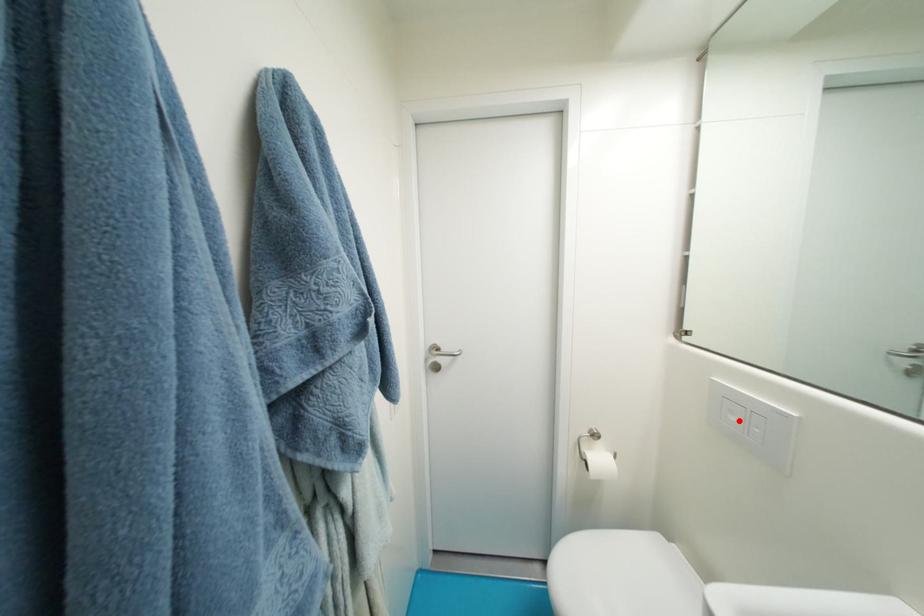
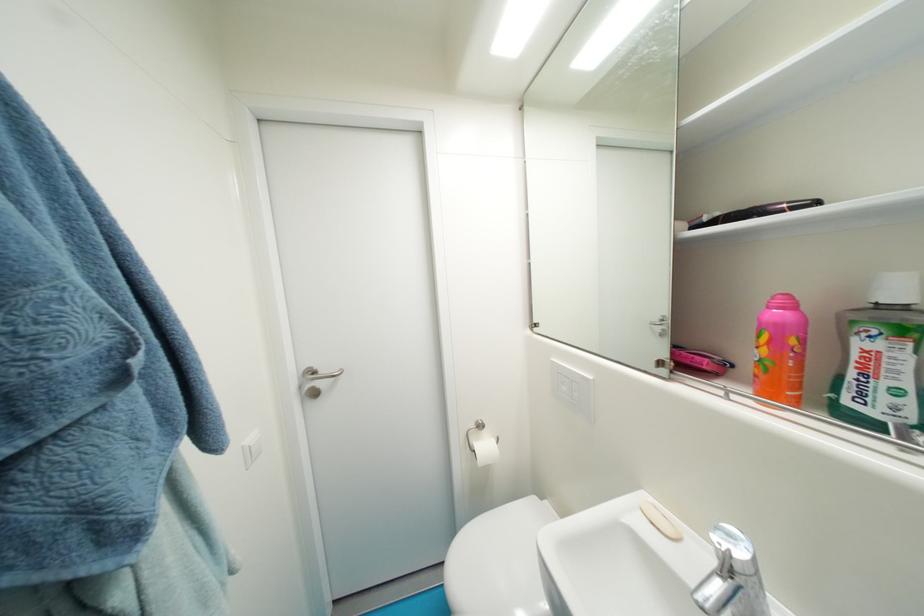
In the second image, find the point that corresponds to the highlighted location in the first image.

(570, 390)